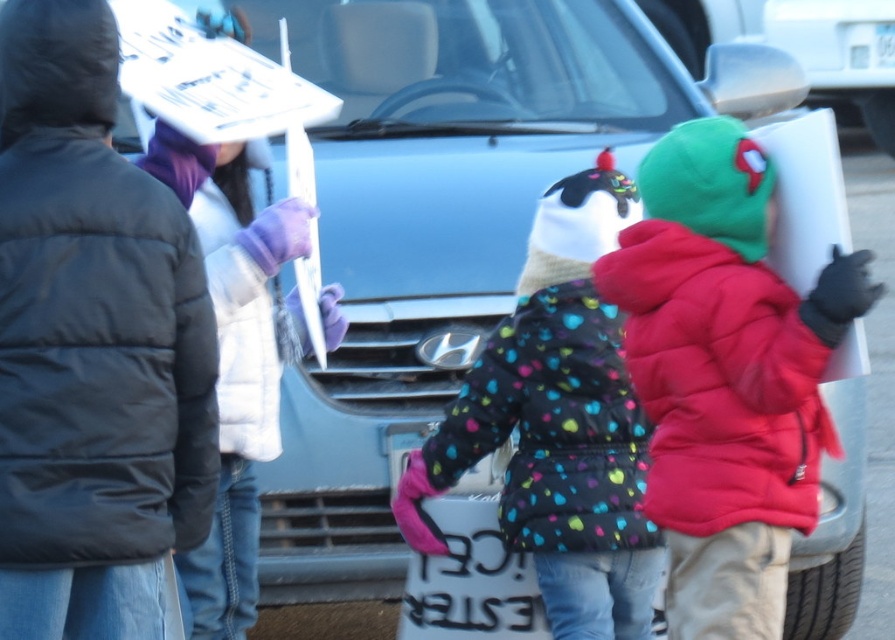
Question: Which point is farther from the camera taking this photo?

Choices:
 (A) (737, 131)
 (B) (563, 497)
 (C) (806, 19)
 (D) (268, 248)

Answer: (C)

Question: Which of these objects is positioned farthest from the metallic silver mirror at upper right?

Choices:
 (A) white puffy jacket at left
 (B) polka dot puffer jacket at center
 (C) matte black jacket at left
 (D) red puffy coat at right

Answer: (C)

Question: Does polka dot puffer jacket at center appear over metallic silver mirror at upper right?

Choices:
 (A) no
 (B) yes

Answer: (A)

Question: Estimate the real-world distances between objects in this image. Which object is farther from the metallic silver mirror at upper right?

Choices:
 (A) red puffy coat at right
 (B) polka dot puffer jacket at center

Answer: (A)

Question: Does matte black jacket at left have a smaller size compared to red puffy coat at right?

Choices:
 (A) yes
 (B) no

Answer: (A)

Question: Can you confirm if matte black jacket at left is smaller than polka dot puffer jacket at center?

Choices:
 (A) no
 (B) yes

Answer: (B)